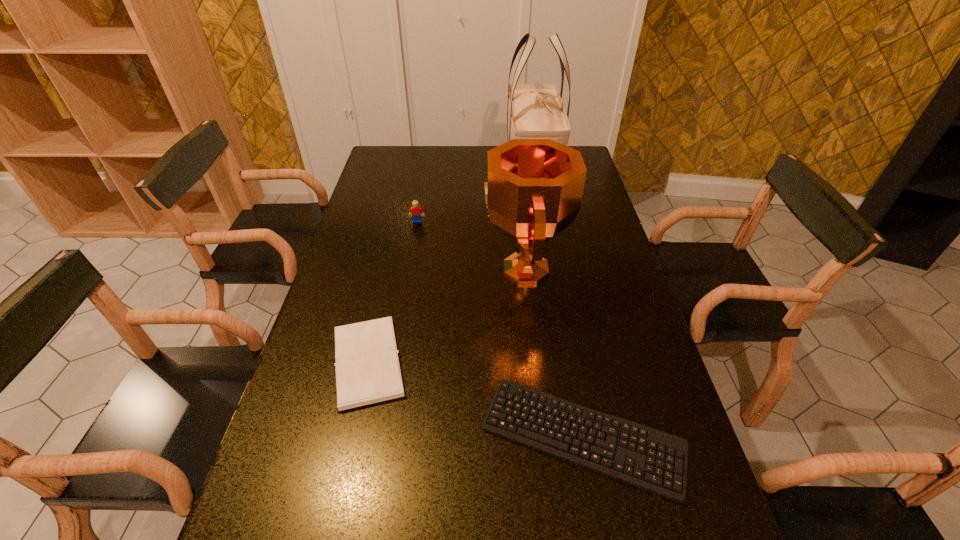
At what (x,y) coordinates should I click in order to perform the action: click on empty location between the computer keyboard and the third tallest object. Please return your answer as a coordinate pair (x, y). This screenshot has height=540, width=960. Looking at the image, I should click on (500, 329).

The width and height of the screenshot is (960, 540). Find the location of `free spot between the shortest object and the second farthest object`. free spot between the shortest object and the second farthest object is located at coordinates (500, 329).

Find the location of a particular element. The height and width of the screenshot is (540, 960). object that is the fourth closest to the shopping bag is located at coordinates pos(652,460).

Locate an element on the screen. object that is the second closest to the third tallest object is located at coordinates (534, 111).

You are a GUI agent. You are given a task and a screenshot of the screen. Output one action in this format:
    pyautogui.click(x=<x>, y=<y>)
    Task: Click on the vacant space that satisfies the following two spatial constraints: 1. on the side of the award with the star emblem; 2. on the left side of the computer keyboard
    The image size is (960, 540).
    Given the screenshot: What is the action you would take?
    pyautogui.click(x=542, y=436)

Image resolution: width=960 pixels, height=540 pixels. I want to click on vacant region that satisfies the following two spatial constraints: 1. on the face of the computer keyboard; 2. on the left side of the Lego, so click(380, 436).

This screenshot has width=960, height=540. Identify the location of vacant area that satisfies the following two spatial constraints: 1. on the side of the award with the star emblem; 2. on the right side of the computer keyboard. point(542,436).

You are a GUI agent. You are given a task and a screenshot of the screen. Output one action in this format:
    pyautogui.click(x=<x>, y=<y>)
    Task: Click on the vacant space that satisfies the following two spatial constraints: 1. with handles facing forward on the shortest object; 2. on the left side of the farthest object
    This screenshot has height=540, width=960.
    Given the screenshot: What is the action you would take?
    pyautogui.click(x=575, y=436)

Identify the location of blank space that satisfies the following two spatial constraints: 1. with handles facing forward on the tallest object; 2. on the right side of the computer keyboard. The width and height of the screenshot is (960, 540). (575, 436).

This screenshot has height=540, width=960. I want to click on free spot that satisfies the following two spatial constraints: 1. on the back side of the computer keyboard; 2. on the side of the award with the star emblem, so click(553, 269).